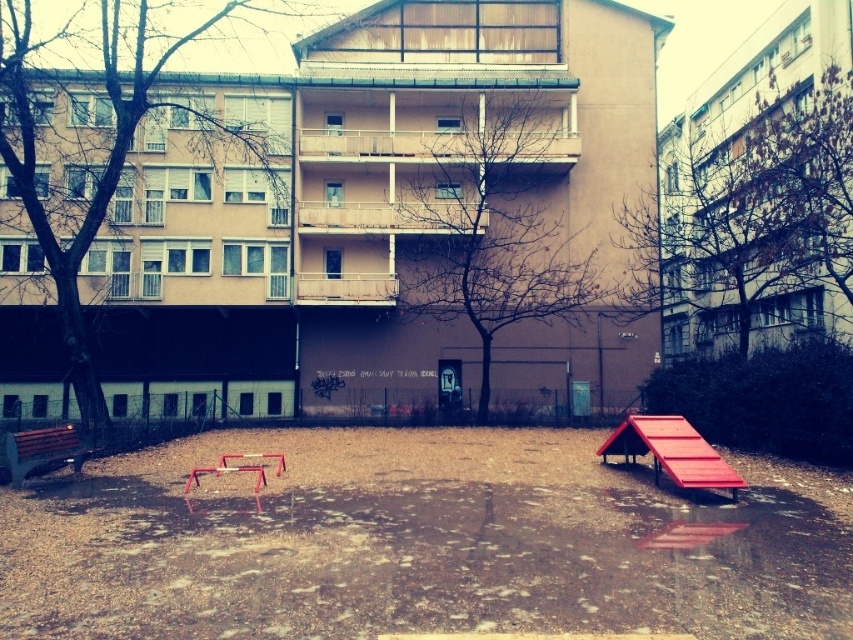
You are standing in the playground area and want to reach the point marked at coordinates point [659,448]. Given that you can walk 1.5 meters per second, how long will it take you to reach that point?

The distance between you and point [659,448] is 13.33 meters. At a walking speed of 1.5 meters per second, it will take approximately 8.89 seconds to reach the point.